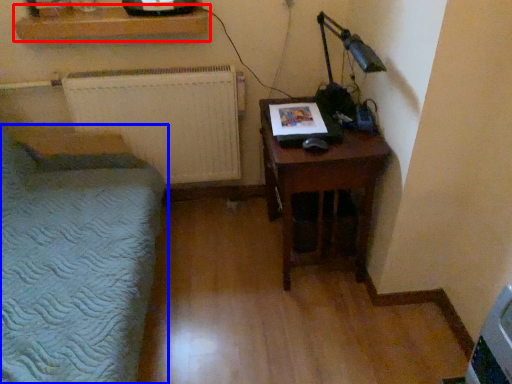
Question: Which point is closer to the camera, shelf (highlighted by a red box) or furniture (highlighted by a blue box)?

Choices:
 (A) shelf
 (B) furniture

Answer: (B)